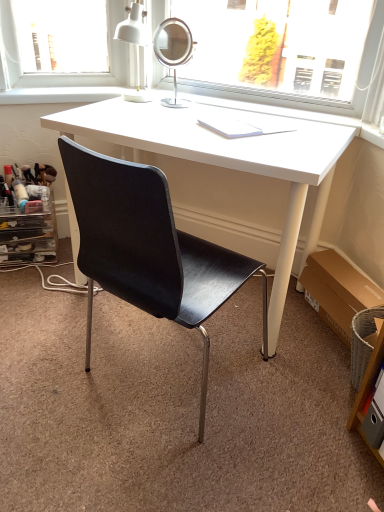
Find the location of a particular element. The height and width of the screenshot is (512, 384). vacant area that is in front of white matte table lamp at upper center is located at coordinates (106, 111).